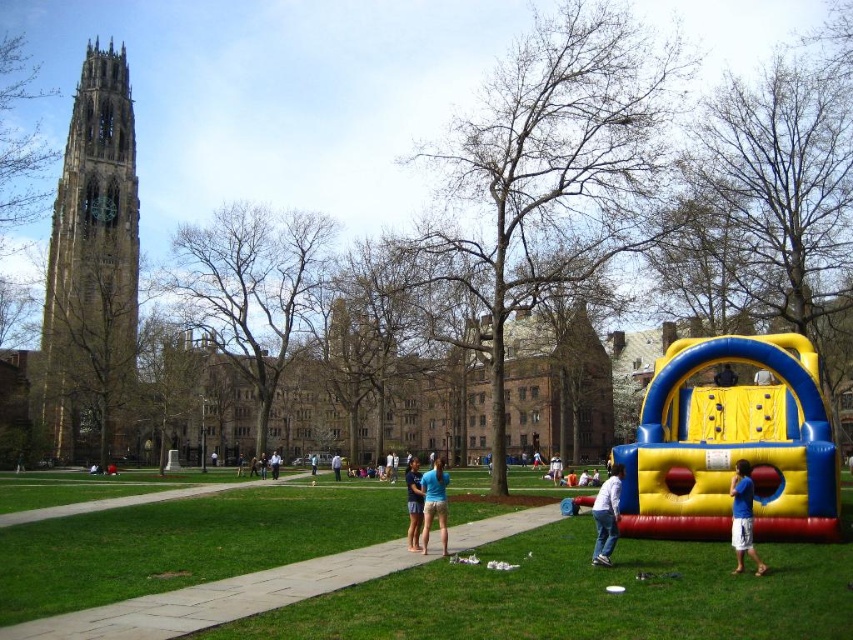
You are standing at the edge of the green grass at lower center and want to walk towards the blue fabric person at lower right. Which direction should you head?

You should walk to the right because the green grass at lower center is to the left of blue fabric person at lower right.

You are planning to take a photo of the golden stone tower at upper left and the blue fabric shorts at center. Which object should you zoom in on to ensure both are fully visible in the frame?

The golden stone tower at upper left is wider than the blue fabric shorts at center, so you should zoom in on the blue fabric shorts at center to ensure both are fully visible in the frame.